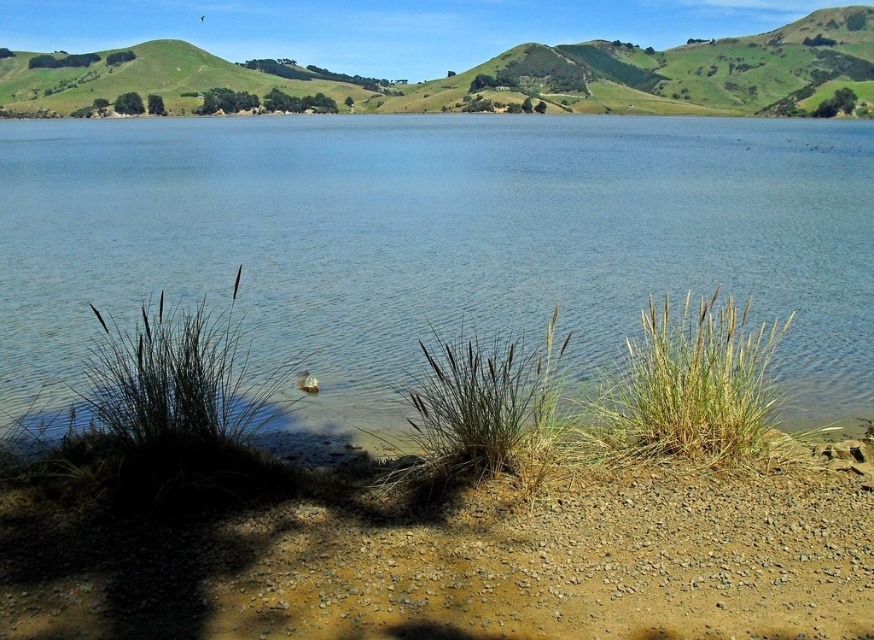
Question: Can you confirm if brown gravelly sand at lower center is positioned above green grassy hill at upper center?

Choices:
 (A) no
 (B) yes

Answer: (A)

Question: Can you confirm if clear blue water at center is thinner than green grassy hill at upper center?

Choices:
 (A) yes
 (B) no

Answer: (A)

Question: Is green grassy hill at upper center thinner than white fluffy duck at lower center?

Choices:
 (A) no
 (B) yes

Answer: (A)

Question: Which point is closer to the camera?

Choices:
 (A) (548, 420)
 (B) (616, 35)
 (C) (260, 573)

Answer: (C)

Question: Which of the following is the farthest from the observer?

Choices:
 (A) clear blue water at center
 (B) white fluffy duck at lower center
 (C) brown gravelly sand at lower center
 (D) green grassy hill at upper left

Answer: (D)

Question: Which is farther from the brown gravelly sand at lower center?

Choices:
 (A) green grassy hill at upper center
 (B) clear blue water at center

Answer: (A)